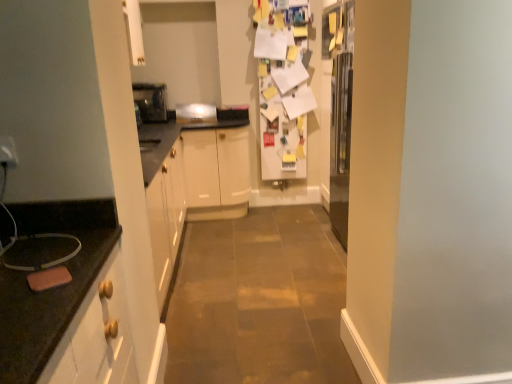
This screenshot has height=384, width=512. What do you see at coordinates (151, 101) in the screenshot?
I see `metallic silver toaster at center, acting as the 1th appliance starting from the left` at bounding box center [151, 101].

Identify the location of metallic silver toaster at center, positioned as the 2th appliance in right-to-left order. Image resolution: width=512 pixels, height=384 pixels. (151, 101).

At what (x,y) coordinates should I click in order to perform the action: click on satin silver toaster at center, the 2th appliance from the left. Please return your answer as a coordinate pair (x, y). Looking at the image, I should click on (195, 113).

In order to face satin silver toaster at center, the 2th appliance from the left, should I rotate leftwards or rightwards?

To face it directly, rotate left by 7.986 degrees.

The image size is (512, 384). What do you see at coordinates (195, 113) in the screenshot?
I see `satin silver toaster at center, the 2th appliance from the left` at bounding box center [195, 113].

Find the location of a particular element. The image size is (512, 384). metallic silver toaster at center, acting as the 1th appliance starting from the left is located at coordinates (151, 101).

Which object is positioned more to the right, metallic silver toaster at center, acting as the 1th appliance starting from the left, or satin silver toaster at center, marked as the first appliance in a right-to-left arrangement?

From the viewer's perspective, satin silver toaster at center, marked as the first appliance in a right-to-left arrangement, appears more on the right side.

Considering the positions of objects metallic silver toaster at center, acting as the 1th appliance starting from the left, and satin silver toaster at center, marked as the first appliance in a right-to-left arrangement, in the image provided, who is in front, metallic silver toaster at center, acting as the 1th appliance starting from the left, or satin silver toaster at center, marked as the first appliance in a right-to-left arrangement,?

metallic silver toaster at center, acting as the 1th appliance starting from the left.

Which point is more distant from viewer, (158, 91) or (193, 114)?

The point (158, 91) is farther from the camera.

From the image's perspective, is metallic silver toaster at center, positioned as the 2th appliance in right-to-left order, on top of satin silver toaster at center, the 2th appliance from the left?

Correct, metallic silver toaster at center, positioned as the 2th appliance in right-to-left order, appears higher than satin silver toaster at center, the 2th appliance from the left, in the image.

From a real-world perspective, who is located lower, metallic silver toaster at center, positioned as the 2th appliance in right-to-left order, or satin silver toaster at center, the 2th appliance from the left?

satin silver toaster at center, the 2th appliance from the left, from a real-world perspective.

Can you confirm if metallic silver toaster at center, acting as the 1th appliance starting from the left, is thinner than satin silver toaster at center, the 2th appliance from the left?

In fact, metallic silver toaster at center, acting as the 1th appliance starting from the left, might be wider than satin silver toaster at center, the 2th appliance from the left.

In terms of height, does metallic silver toaster at center, acting as the 1th appliance starting from the left, look taller or shorter compared to satin silver toaster at center, the 2th appliance from the left?

metallic silver toaster at center, acting as the 1th appliance starting from the left, is taller than satin silver toaster at center, the 2th appliance from the left.

Which of these two, metallic silver toaster at center, positioned as the 2th appliance in right-to-left order, or satin silver toaster at center, marked as the first appliance in a right-to-left arrangement, is bigger?

Bigger between the two is metallic silver toaster at center, positioned as the 2th appliance in right-to-left order.

Is metallic silver toaster at center, acting as the 1th appliance starting from the left, located outside satin silver toaster at center, the 2th appliance from the left?

metallic silver toaster at center, acting as the 1th appliance starting from the left, is positioned outside satin silver toaster at center, the 2th appliance from the left.

Is metallic silver toaster at center, positioned as the 2th appliance in right-to-left order, not near satin silver toaster at center, the 2th appliance from the left?

No, there isn't a large distance between metallic silver toaster at center, positioned as the 2th appliance in right-to-left order, and satin silver toaster at center, the 2th appliance from the left.

Is metallic silver toaster at center, acting as the 1th appliance starting from the left, aimed at satin silver toaster at center, marked as the first appliance in a right-to-left arrangement?

No, metallic silver toaster at center, acting as the 1th appliance starting from the left, is not aimed at satin silver toaster at center, marked as the first appliance in a right-to-left arrangement.

Consider the image. What's the angular difference between metallic silver toaster at center, acting as the 1th appliance starting from the left, and satin silver toaster at center, marked as the first appliance in a right-to-left arrangement,'s facing directions?

There is a 0.918-degree angle between the facing directions of metallic silver toaster at center, acting as the 1th appliance starting from the left, and satin silver toaster at center, marked as the first appliance in a right-to-left arrangement.

The image size is (512, 384). I want to click on appliance located on the left of satin silver toaster at center, the 2th appliance from the left, so click(x=151, y=101).

Which object is positioned more to the left, satin silver toaster at center, the 2th appliance from the left, or metallic silver toaster at center, acting as the 1th appliance starting from the left?

metallic silver toaster at center, acting as the 1th appliance starting from the left.

Is the position of satin silver toaster at center, marked as the first appliance in a right-to-left arrangement, less distant than that of metallic silver toaster at center, acting as the 1th appliance starting from the left?

No, satin silver toaster at center, marked as the first appliance in a right-to-left arrangement, is further to the viewer.

Is point (202, 115) less distant than point (142, 87)?

Yes, point (202, 115) is in front of point (142, 87).

From the image's perspective, which is below, satin silver toaster at center, marked as the first appliance in a right-to-left arrangement, or metallic silver toaster at center, positioned as the 2th appliance in right-to-left order?

satin silver toaster at center, marked as the first appliance in a right-to-left arrangement, from the image's perspective.

From a real-world perspective, is satin silver toaster at center, the 2th appliance from the left, located beneath metallic silver toaster at center, positioned as the 2th appliance in right-to-left order?

Yes.

Can you confirm if satin silver toaster at center, the 2th appliance from the left, is wider than metallic silver toaster at center, positioned as the 2th appliance in right-to-left order?

In fact, satin silver toaster at center, the 2th appliance from the left, might be narrower than metallic silver toaster at center, positioned as the 2th appliance in right-to-left order.

Who is shorter, satin silver toaster at center, marked as the first appliance in a right-to-left arrangement, or metallic silver toaster at center, acting as the 1th appliance starting from the left?

satin silver toaster at center, marked as the first appliance in a right-to-left arrangement.

Based on the photo, who is smaller, satin silver toaster at center, marked as the first appliance in a right-to-left arrangement, or metallic silver toaster at center, positioned as the 2th appliance in right-to-left order?

satin silver toaster at center, marked as the first appliance in a right-to-left arrangement.

Is metallic silver toaster at center, acting as the 1th appliance starting from the left, completely or partially inside satin silver toaster at center, the 2th appliance from the left?

Actually, metallic silver toaster at center, acting as the 1th appliance starting from the left, is outside satin silver toaster at center, the 2th appliance from the left.

Based on the photo, are satin silver toaster at center, marked as the first appliance in a right-to-left arrangement, and metallic silver toaster at center, acting as the 1th appliance starting from the left, far apart?

Actually, satin silver toaster at center, marked as the first appliance in a right-to-left arrangement, and metallic silver toaster at center, acting as the 1th appliance starting from the left, are a little close together.

Is satin silver toaster at center, the 2th appliance from the left, oriented towards metallic silver toaster at center, acting as the 1th appliance starting from the left?

No, satin silver toaster at center, the 2th appliance from the left, is not oriented towards metallic silver toaster at center, acting as the 1th appliance starting from the left.

Can you tell me how much satin silver toaster at center, marked as the first appliance in a right-to-left arrangement, and metallic silver toaster at center, acting as the 1th appliance starting from the left, differ in facing direction?

The facing directions of satin silver toaster at center, marked as the first appliance in a right-to-left arrangement, and metallic silver toaster at center, acting as the 1th appliance starting from the left, are 0.918 degrees apart.

The width and height of the screenshot is (512, 384). I want to click on appliance above the satin silver toaster at center, the 2th appliance from the left (from a real-world perspective), so click(151, 101).

The image size is (512, 384). Identify the location of appliance above the satin silver toaster at center, the 2th appliance from the left (from the image's perspective). (151, 101).

Locate an element on the screen. The width and height of the screenshot is (512, 384). appliance below the metallic silver toaster at center, positioned as the 2th appliance in right-to-left order (from a real-world perspective) is located at coordinates (195, 113).